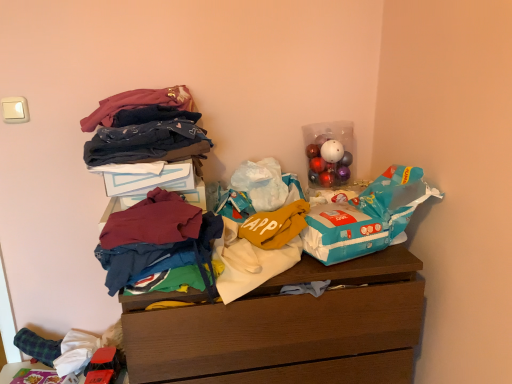
The height and width of the screenshot is (384, 512). In order to click on free spot above maroon cotton t-shirt at center, arranged as the 1th clothing when ordered from the bottom (from a real-world perspective) in this screenshot , I will do `click(156, 225)`.